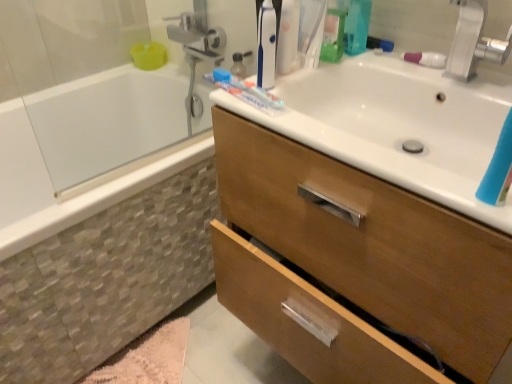
Image resolution: width=512 pixels, height=384 pixels. In order to click on space that is in front of blue plastic toothbrush at upper center in this screenshot , I will do `click(301, 129)`.